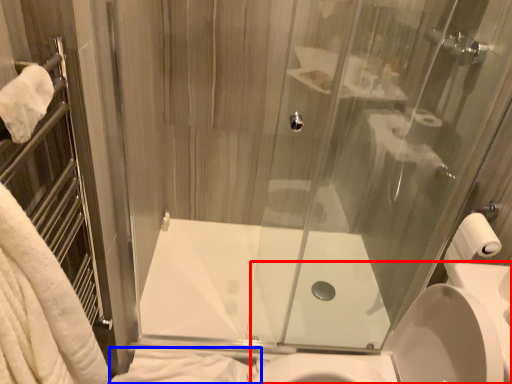
Question: Which object appears farthest to the camera in this image, sink (highlighted by a red box) or bath towel (highlighted by a blue box)?

Choices:
 (A) sink
 (B) bath towel

Answer: (B)